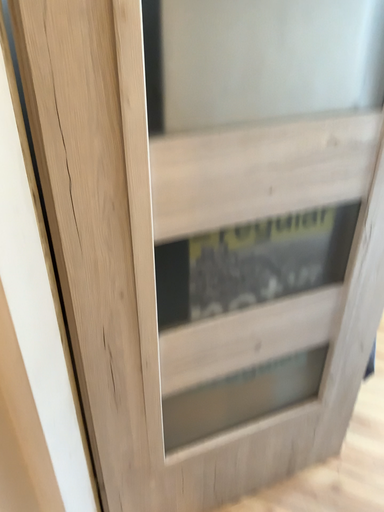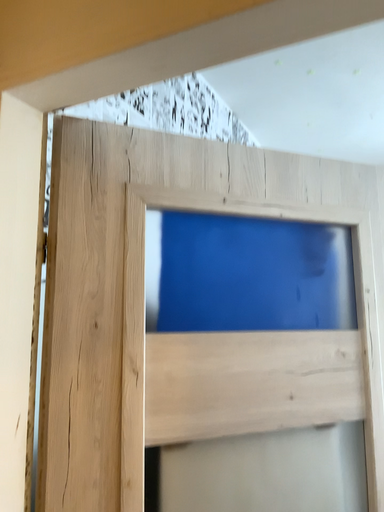
Question: How did the camera likely rotate when shooting the video?

Choices:
 (A) rotated downward
 (B) rotated upward

Answer: (B)